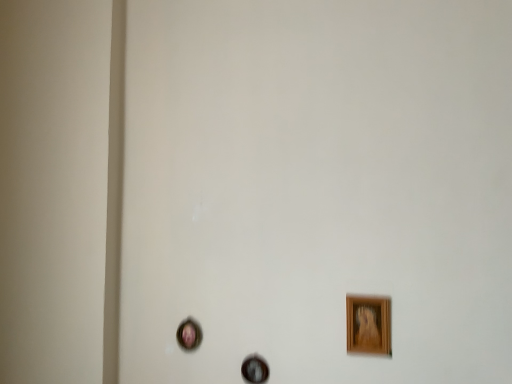
Question: In which direction should I rotate to look at wooden picture frame at center, which is the 2th picture frame in back-to-front order?

Choices:
 (A) right
 (B) left

Answer: (B)

Question: Should I look upward or downward to see wooden picture frame at lower right, positioned as the 3th picture frame in left-to-right order?

Choices:
 (A) up
 (B) down

Answer: (B)

Question: Considering the relative sizes of wooden picture frame at lower right, which is counted as the first picture frame, starting from the right, and matte pink picture frame at lower left, which is counted as the first picture frame, starting from the back, in the image provided, is wooden picture frame at lower right, which is counted as the first picture frame, starting from the right, wider than matte pink picture frame at lower left, which is counted as the first picture frame, starting from the back,?

Choices:
 (A) no
 (B) yes

Answer: (A)

Question: Could you tell me if wooden picture frame at lower right, which is counted as the first picture frame, starting from the right, is turned towards matte pink picture frame at lower left, the 3th picture frame positioned from the right?

Choices:
 (A) no
 (B) yes

Answer: (A)

Question: Are wooden picture frame at lower right, positioned as the 3th picture frame in left-to-right order, and matte pink picture frame at lower left, the first picture frame when ordered from left to right, far apart?

Choices:
 (A) yes
 (B) no

Answer: (B)

Question: Is wooden picture frame at lower right, the third picture frame in the back-to-front sequence, beside matte pink picture frame at lower left, positioned as the third picture frame in front-to-back order?

Choices:
 (A) no
 (B) yes

Answer: (A)

Question: From a real-world perspective, does wooden picture frame at lower right, placed as the 1th picture frame when sorted from front to back, stand above matte pink picture frame at lower left, the first picture frame when ordered from left to right?

Choices:
 (A) no
 (B) yes

Answer: (B)

Question: Does wooden picture frame at lower right, the third picture frame in the back-to-front sequence, contain matte pink picture frame at lower left, the first picture frame when ordered from left to right?

Choices:
 (A) yes
 (B) no

Answer: (B)

Question: Is the depth of wooden picture frame at center, which is counted as the 2th picture frame, starting from the left, less than that of matte pink picture frame at lower left, which is counted as the first picture frame, starting from the back?

Choices:
 (A) yes
 (B) no

Answer: (A)

Question: Is wooden picture frame at center, which is the 2th picture frame in back-to-front order, positioned with its back to matte pink picture frame at lower left, the 3th picture frame positioned from the right?

Choices:
 (A) no
 (B) yes

Answer: (A)

Question: Does wooden picture frame at center, the second picture frame in the right-to-left sequence, turn towards matte pink picture frame at lower left, the 3th picture frame positioned from the right?

Choices:
 (A) no
 (B) yes

Answer: (A)

Question: Can you confirm if wooden picture frame at center, the second picture frame in the right-to-left sequence, is smaller than matte pink picture frame at lower left, the first picture frame when ordered from left to right?

Choices:
 (A) yes
 (B) no

Answer: (A)

Question: Would you say wooden picture frame at center, the second picture frame in the right-to-left sequence, is outside matte pink picture frame at lower left, positioned as the third picture frame in front-to-back order?

Choices:
 (A) yes
 (B) no

Answer: (A)

Question: Does wooden picture frame at center, the second picture frame in the right-to-left sequence, appear on the right side of matte pink picture frame at lower left, positioned as the third picture frame in front-to-back order?

Choices:
 (A) yes
 (B) no

Answer: (A)

Question: From a real-world perspective, does wooden picture frame at lower right, which is counted as the first picture frame, starting from the right, stand above wooden picture frame at center, the 2th picture frame from the front?

Choices:
 (A) no
 (B) yes

Answer: (B)